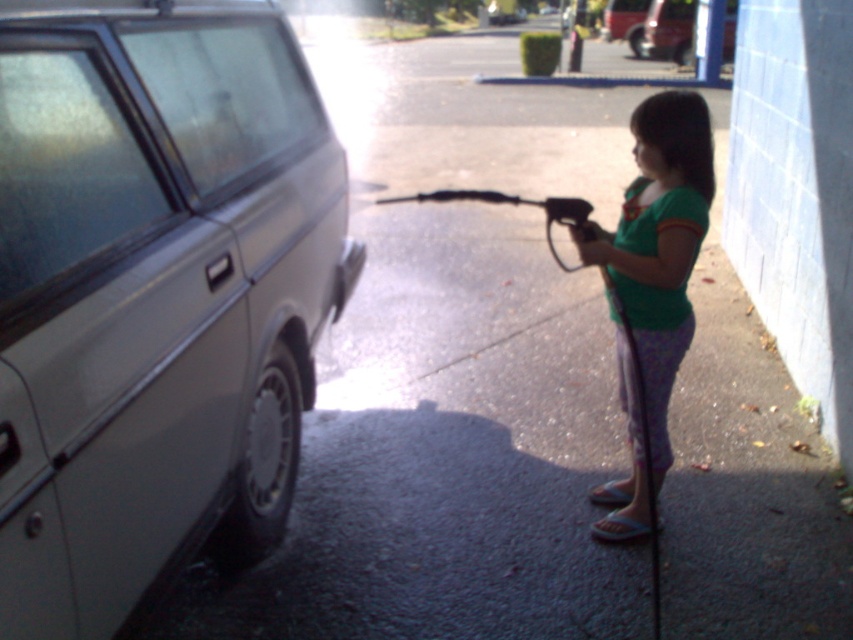
Is point (688, 122) closer to viewer compared to point (450, 196)?

Yes, point (688, 122) is in front of point (450, 196).

Which of these two, green fabric shirt at right or black rubber hose at center, stands taller?

green fabric shirt at right is taller.

Which is behind, point (643, 323) or point (587, 202)?

Point (587, 202)

Find the location of a particular element. The width and height of the screenshot is (853, 640). green fabric shirt at right is located at coordinates (659, 243).

Can you confirm if matte silver minivan at left is positioned below metallic silver car at center?

Correct, matte silver minivan at left is located below metallic silver car at center.

Can you confirm if matte silver minivan at left is wider than metallic silver car at center?

No.

Does point (177, 435) come in front of point (627, 13)?

Yes.

Find the location of a particular element. matte silver minivan at left is located at coordinates (154, 294).

Is metallic silver car at upper center to the left of metallic silver car at center from the viewer's perspective?

Incorrect, metallic silver car at upper center is not on the left side of metallic silver car at center.

Is point (660, 29) closer to camera compared to point (605, 12)?

Yes, it is in front of point (605, 12).

Identify the location of metallic silver car at upper center. The height and width of the screenshot is (640, 853). (669, 29).

Locate an element on the screen. The height and width of the screenshot is (640, 853). metallic silver car at upper center is located at coordinates (669, 29).